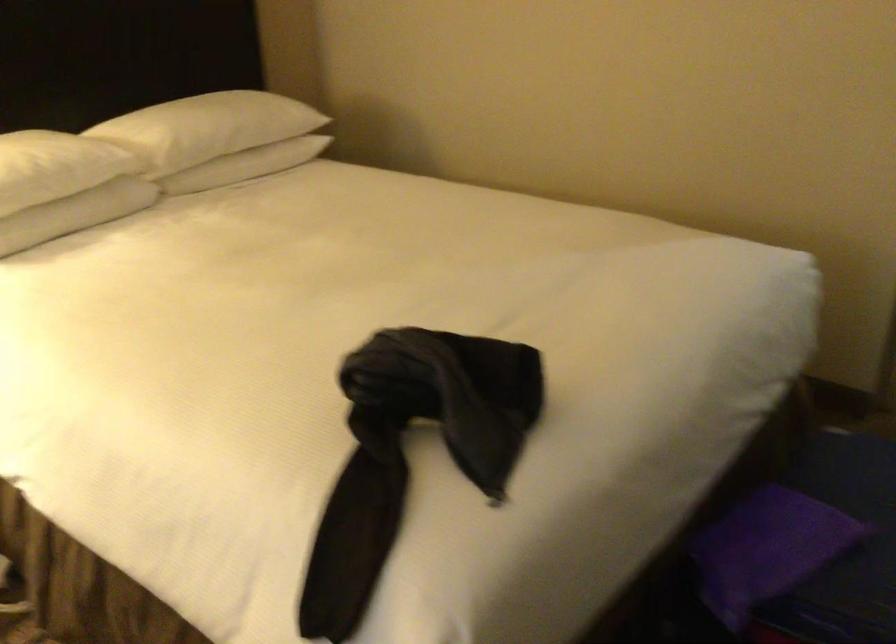
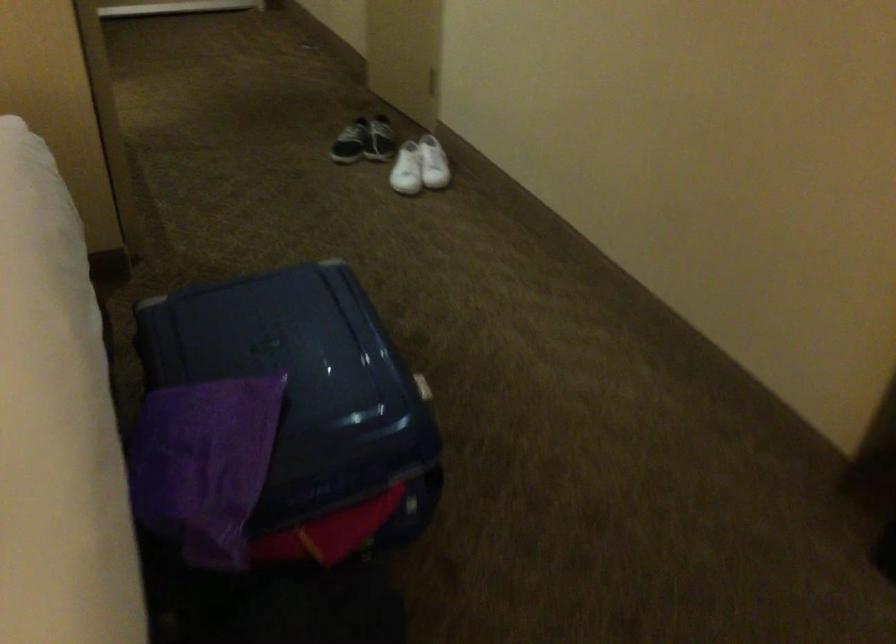
The images are taken continuously from a first-person perspective. In which direction is your viewpoint rotating?

The rotation direction of the camera is right-down.